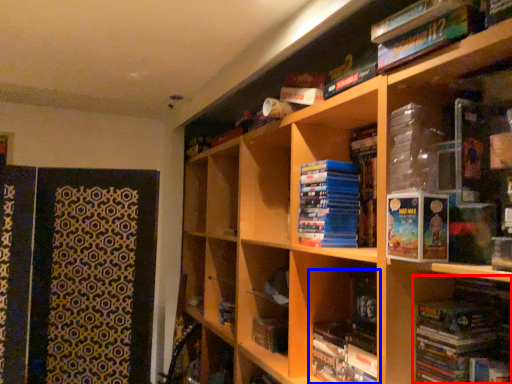
Question: Which object appears closest to the camera in this image, book (highlighted by a red box) or book (highlighted by a blue box)?

Choices:
 (A) book
 (B) book

Answer: (A)